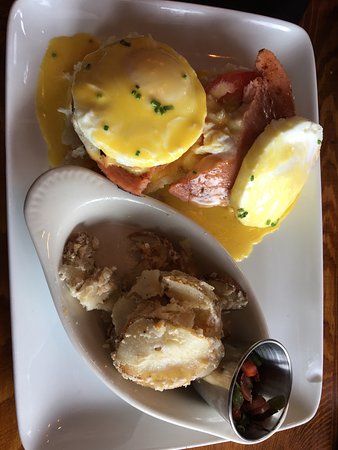
This screenshot has height=450, width=338. I want to click on silverware, so click(x=57, y=208), click(x=28, y=372), click(x=269, y=354).